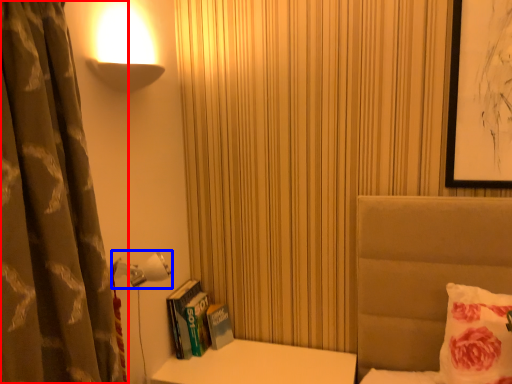
Question: Which object is further to the camera taking this photo, curtain (highlighted by a red box) or lamp (highlighted by a blue box)?

Choices:
 (A) curtain
 (B) lamp

Answer: (B)